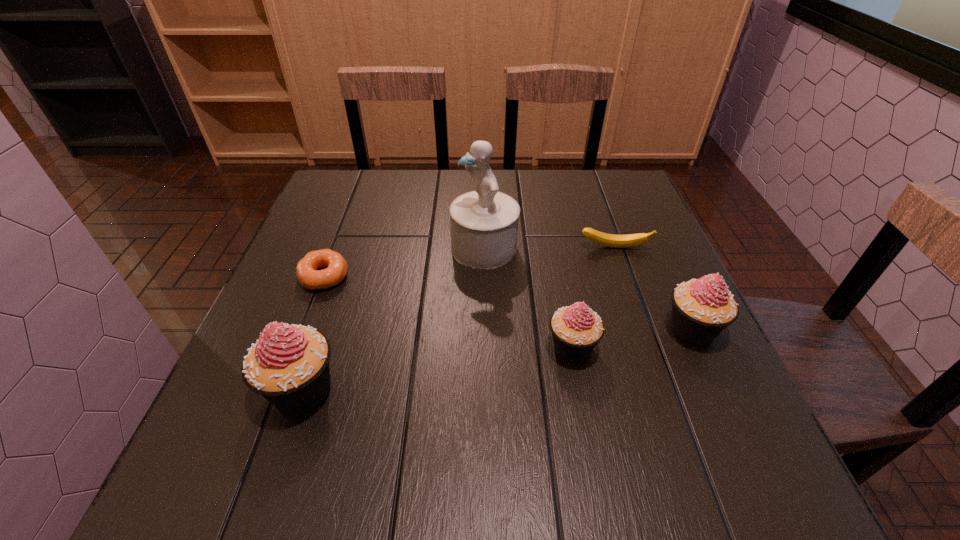
What are the coordinates of `vacant space situated on the left of the third shortest object` in the screenshot? It's located at coord(484,348).

At what (x,y) coordinates should I click in order to perform the action: click on free space located on the left of the second tallest cupcake. Please return your answer as a coordinate pair (x, y). The height and width of the screenshot is (540, 960). Looking at the image, I should click on (567, 329).

You are a GUI agent. You are given a task and a screenshot of the screen. Output one action in this format:
    pyautogui.click(x=<x>, y=<y>)
    Task: Click on the blank area located 0.320m at the beak of the figurine
    Image resolution: width=960 pixels, height=540 pixels.
    Given the screenshot: What is the action you would take?
    [320, 248]

Where is `vacant space located at the beak of the figurine`? The image size is (960, 540). vacant space located at the beak of the figurine is located at coordinates (372, 248).

Find the location of a particular element. The width and height of the screenshot is (960, 540). free space located 0.280m at the beak of the figurine is located at coordinates (336, 248).

Identify the location of vacant area located 0.380m on the back of the doughnut. (362, 177).

Identify the location of free region located 0.290m at the stem of the banana. (650, 349).

The image size is (960, 540). I want to click on object at the near edge, so click(289, 365).

Locate an element on the screen. This screenshot has height=540, width=960. cupcake at the left edge is located at coordinates (289, 365).

Where is `doughnut that is at the left edge`? This screenshot has width=960, height=540. doughnut that is at the left edge is located at coordinates [x=309, y=276].